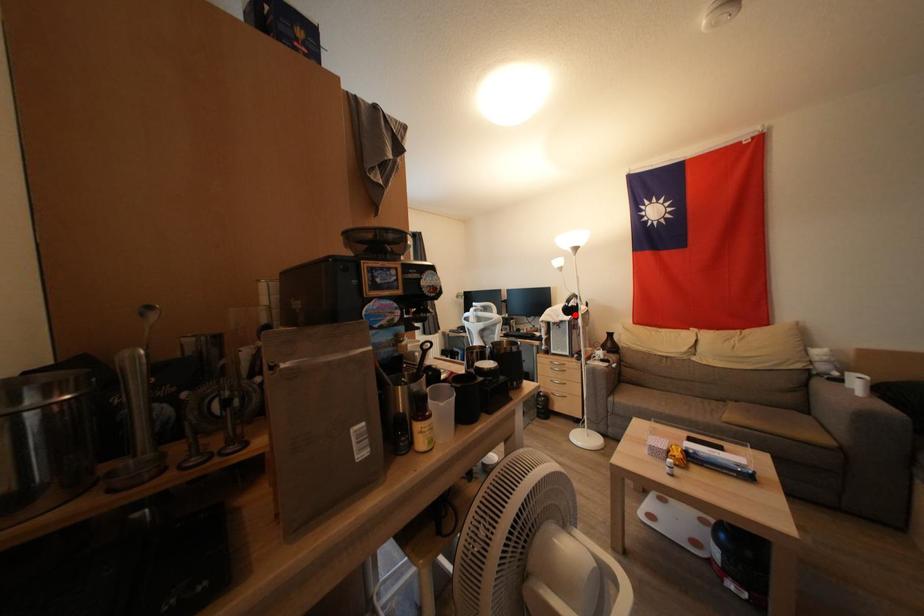
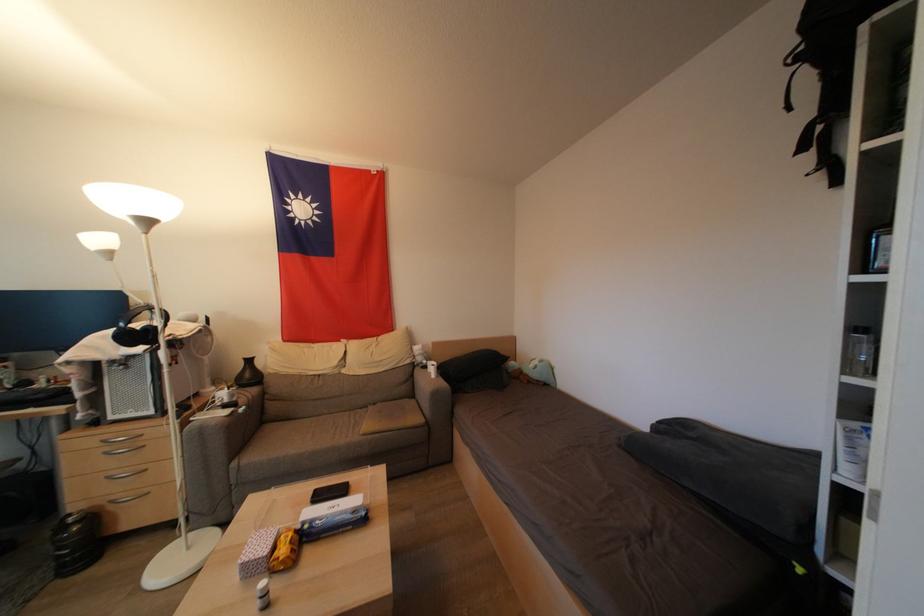
The point at the highlighted location is marked in the first image. Where is the corresponding point in the second image?

(142, 339)